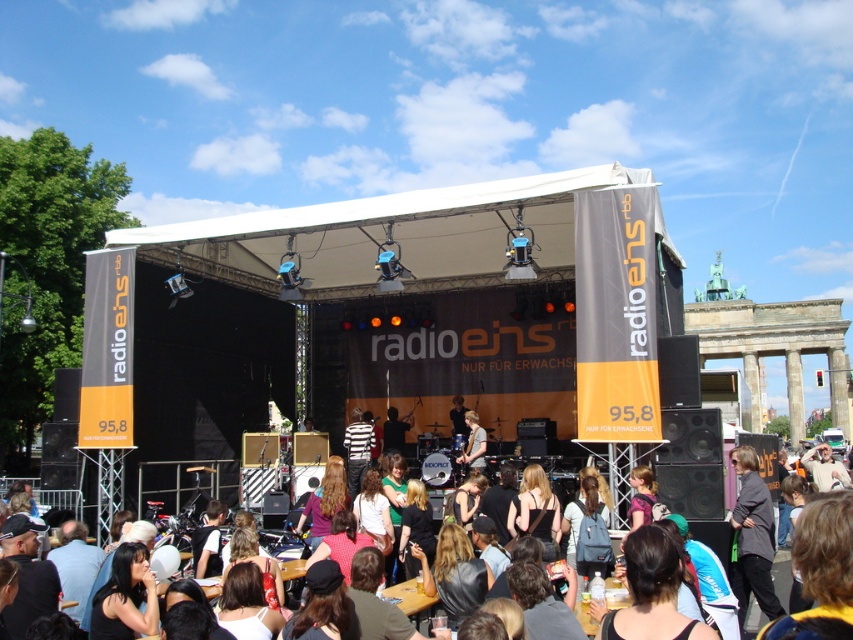
Question: Estimate the real-world distances between objects in this image. Which object is closer to the dark gray fabric jacket at lower right?

Choices:
 (A) matte black guitar at center
 (B) matte black jacket at center
 (C) shiny silver guitar at center

Answer: (A)

Question: Where is dark gray fabric jacket at lower right located in relation to shiny silver guitar at center in the image?

Choices:
 (A) below
 (B) above

Answer: (A)

Question: Which point is farther to the camera?

Choices:
 (A) (456, 413)
 (B) (727, 529)

Answer: (A)

Question: Which object appears farthest from the camera in this image?

Choices:
 (A) dark gray fabric jacket at lower right
 (B) matte black jacket at center

Answer: (B)

Question: Does dark gray fabric jacket at lower right lie behind matte black jacket at center?

Choices:
 (A) yes
 (B) no

Answer: (B)

Question: Does matte black jacket at center appear on the left side of matte black guitar at center?

Choices:
 (A) yes
 (B) no

Answer: (A)